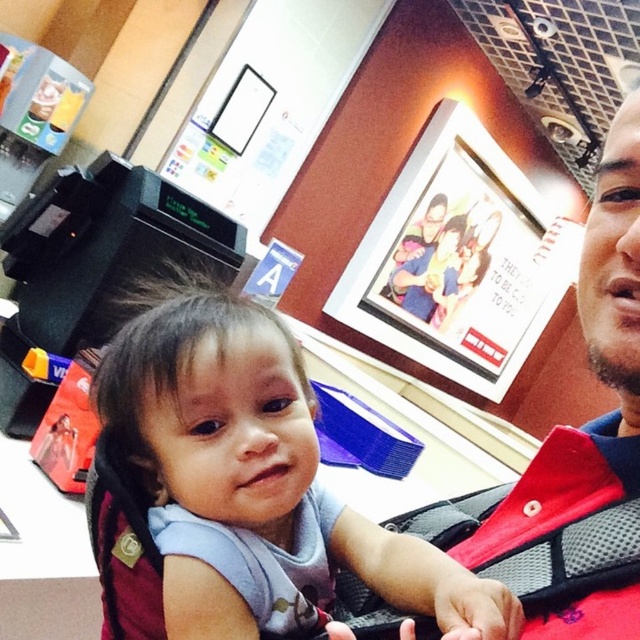
Question: Does smooth blue bib at center appear on the right side of matte red shirt at upper right?

Choices:
 (A) yes
 (B) no

Answer: (B)

Question: Which object appears farthest from the camera in this image?

Choices:
 (A) smooth blue bib at center
 (B) matte red shirt at upper right

Answer: (A)

Question: Does smooth blue bib at center appear on the left side of matte red shirt at upper right?

Choices:
 (A) yes
 (B) no

Answer: (A)

Question: Is smooth blue bib at center wider than matte red shirt at upper right?

Choices:
 (A) yes
 (B) no

Answer: (A)

Question: Among these points, which one is nearest to the camera?

Choices:
 (A) (595, 310)
 (B) (132, 289)

Answer: (A)